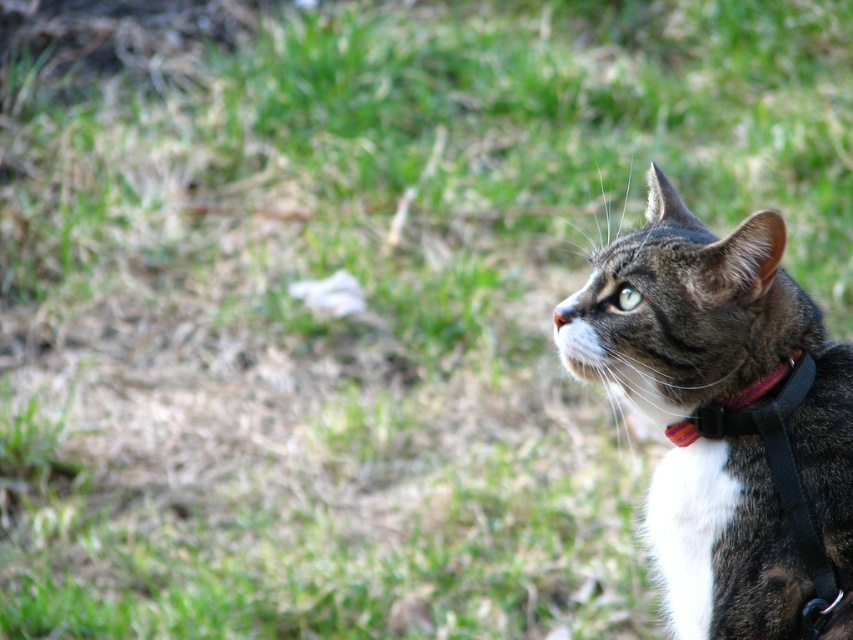
Question: Is tabby fur cat at right to the left of multicolored fabric collar at right from the viewer's perspective?

Choices:
 (A) no
 (B) yes

Answer: (B)

Question: Which point is closer to the camera?

Choices:
 (A) (831, 445)
 (B) (741, 401)

Answer: (A)

Question: Is tabby fur cat at right to the right of multicolored fabric collar at right from the viewer's perspective?

Choices:
 (A) yes
 (B) no

Answer: (B)

Question: Is tabby fur cat at right smaller than multicolored fabric collar at right?

Choices:
 (A) no
 (B) yes

Answer: (A)

Question: Which point is closer to the camera?

Choices:
 (A) tabby fur cat at right
 (B) multicolored fabric collar at right

Answer: (A)